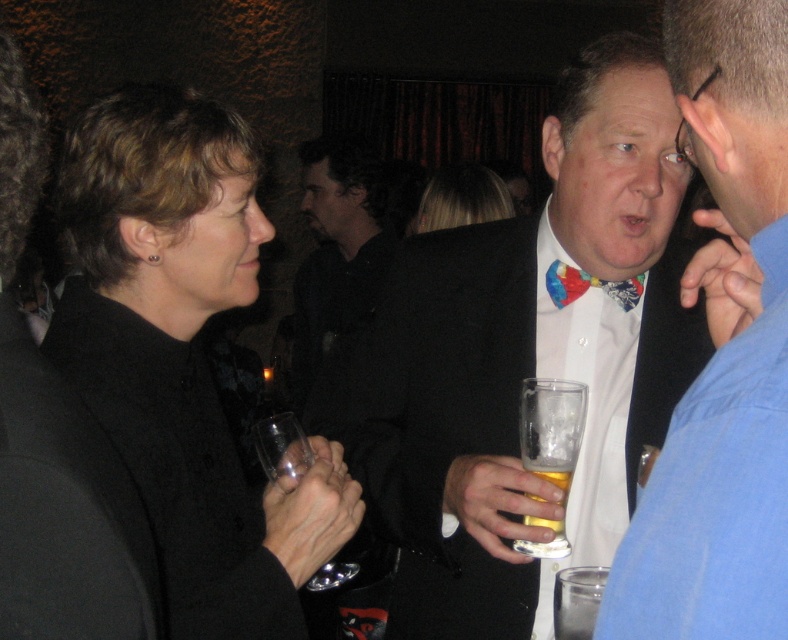
Is blonde hair at center thinner than multicolored fabric bow tie at center?

No.

Locate an element on the screen. The width and height of the screenshot is (788, 640). blonde hair at center is located at coordinates (461, 198).

Who is higher up, black matte suit at center or clear glass beer at center?

Positioned higher is black matte suit at center.

Who is lower down, black matte suit at center or clear glass beer at center?

clear glass beer at center

Who is more forward, (322, 358) or (565, 442)?

Positioned in front is point (565, 442).

Find the location of a particular element. black matte suit at center is located at coordinates (337, 250).

Which is above, black matte coat at left or transparent glass at center?

Positioned higher is black matte coat at left.

Between black matte coat at left and transparent glass at center, which one appears on the right side from the viewer's perspective?

Positioned to the right is transparent glass at center.

What do you see at coordinates (184, 355) in the screenshot? I see `black matte coat at left` at bounding box center [184, 355].

Where is `black matte coat at left`? black matte coat at left is located at coordinates (184, 355).